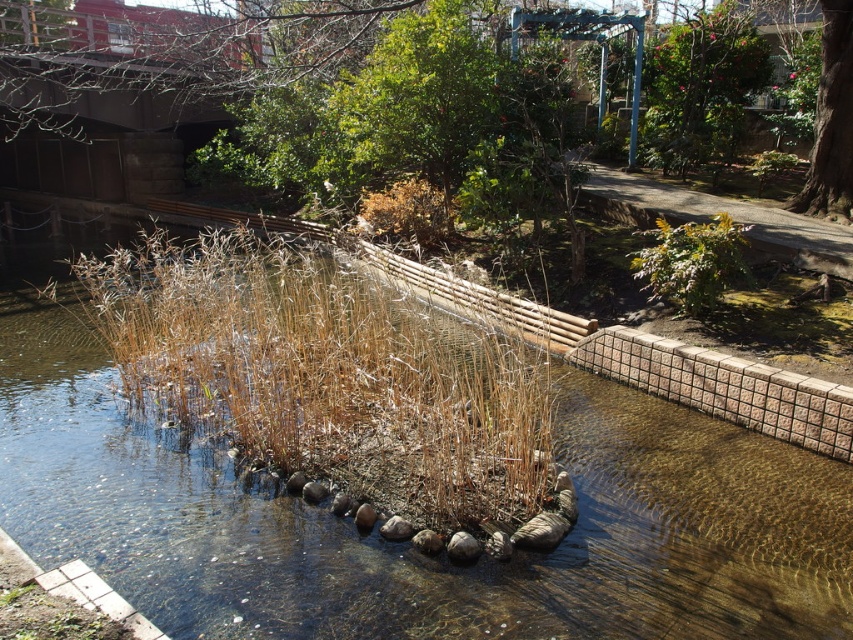
How distant is dry grass at center from green leafy tree at upper right?

dry grass at center and green leafy tree at upper right are 28.42 feet apart.

Does dry grass at center have a lesser width compared to green leafy tree at upper right?

Correct, dry grass at center's width is less than green leafy tree at upper right's.

Locate an element on the screen. This screenshot has width=853, height=640. dry grass at center is located at coordinates (325, 376).

Where is `dry grass at center`? dry grass at center is located at coordinates (325, 376).

The height and width of the screenshot is (640, 853). I want to click on brown grassy stream at center, so click(x=403, y=545).

Does brown grassy stream at center have a greater width compared to green leafy plant at center-right?

Indeed, brown grassy stream at center has a greater width compared to green leafy plant at center-right.

Find the location of `brown grassy stream at center`. brown grassy stream at center is located at coordinates (403, 545).

Who is shorter, green leafy tree at upper right or green leafy plant at center-right?

green leafy plant at center-right is shorter.

Between green leafy tree at upper right and green leafy plant at center-right, which one has more height?

green leafy tree at upper right

Between point (810, 163) and point (706, 264), which one is positioned behind?

The point (810, 163) is behind.

Where is `green leafy tree at upper right`? Image resolution: width=853 pixels, height=640 pixels. green leafy tree at upper right is located at coordinates pyautogui.click(x=831, y=120).